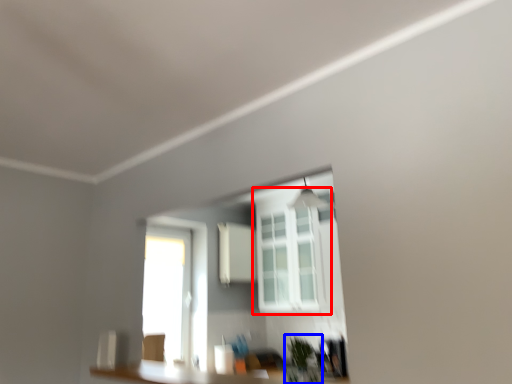
Question: Which object is closer to the camera taking this photo, window (highlighted by a red box) or plant (highlighted by a blue box)?

Choices:
 (A) window
 (B) plant

Answer: (B)